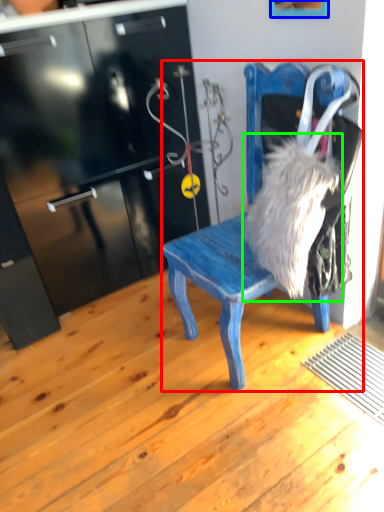
Question: Estimate the real-world distances between objects in this image. Which object is farther from chair (highlighted by a red box), picture frame (highlighted by a blue box) or animal (highlighted by a green box)?

Choices:
 (A) picture frame
 (B) animal

Answer: (A)